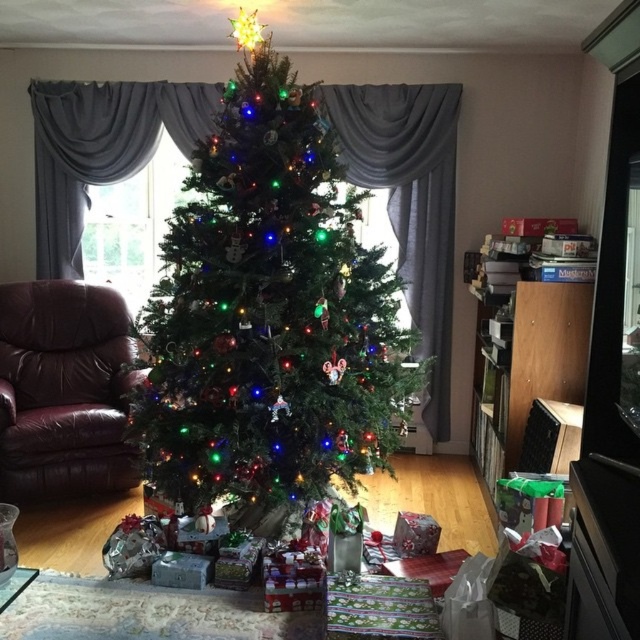
You are planning to place a new rectangular sofa in the living room. The sofa is 1.5 meters wide. You want to position it between the green matte christmas tree at center and the leather armchair at left. Is there enough space between them to fit the sofa?

The green matte christmas tree at center is wider than the leather armchair at left. However, the exact distance between them isn not provided in the scene description. To determine if the sofa fits, you need to measure the space between the two objects or ensure there is at least 1.5 meters of clearance.

You are sitting in the leather armchair at left and want to reach for the green matte christmas tree at center. Is the tree within your immediate reach from your current position?

The green matte christmas tree at center is in front of the leather armchair at left, so it is within immediate reach from the leather armchair at left.